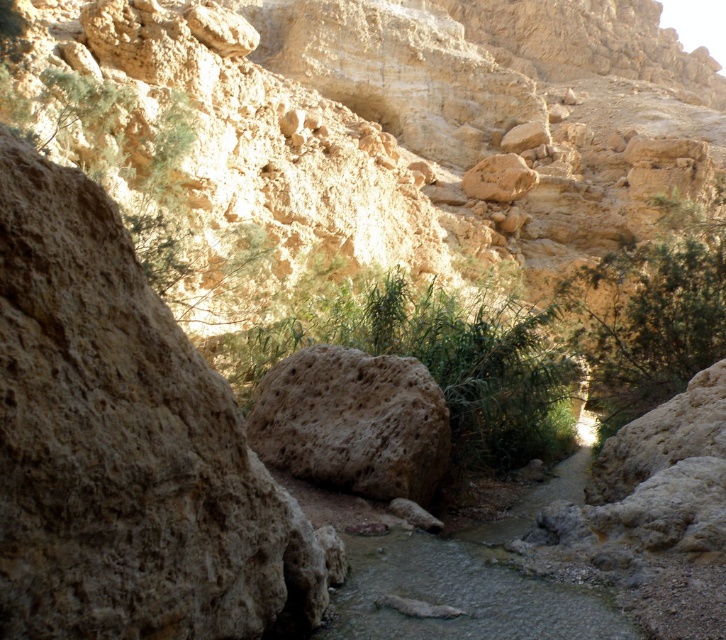
I want to click on green leafy bush at upper right, so click(650, 308).

I want to click on green leafy bush at upper right, so click(x=650, y=308).

Can you confirm if green leafy bush at center is positioned above brown porous rock at center?

Indeed, green leafy bush at center is positioned over brown porous rock at center.

Does green leafy bush at center have a greater height compared to brown porous rock at center?

Indeed, green leafy bush at center has a greater height compared to brown porous rock at center.

Image resolution: width=726 pixels, height=640 pixels. What do you see at coordinates (439, 358) in the screenshot?
I see `green leafy bush at center` at bounding box center [439, 358].

Identify the location of green leafy bush at center. (439, 358).

Is brown rough rock at left to the right of brown porous rock at center from the viewer's perspective?

Incorrect, brown rough rock at left is not on the right side of brown porous rock at center.

Consider the image. Does brown rough rock at left have a lesser width compared to brown porous rock at center?

No, brown rough rock at left is not thinner than brown porous rock at center.

I want to click on brown rough rock at left, so click(x=123, y=445).